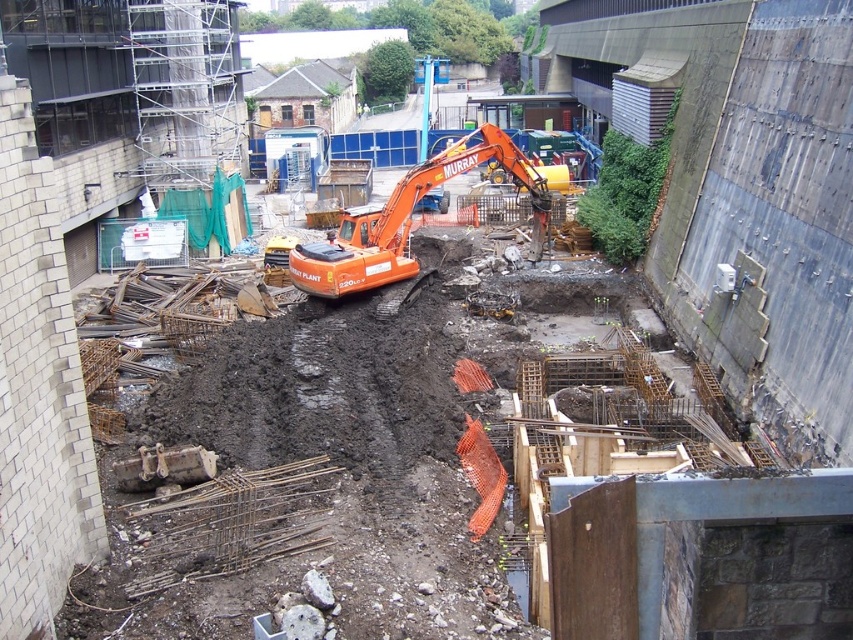
Question: Does orange rubber excavator at center appear on the right side of orange hard hat at center?

Choices:
 (A) yes
 (B) no

Answer: (A)

Question: Which of the following is the closest to the observer?

Choices:
 (A) coord(326,241)
 (B) coord(408,227)

Answer: (B)

Question: Can you confirm if orange rubber excavator at center is smaller than orange hard hat at center?

Choices:
 (A) yes
 (B) no

Answer: (B)

Question: Which object appears farthest from the camera in this image?

Choices:
 (A) orange hard hat at center
 (B) orange rubber excavator at center

Answer: (A)

Question: Does orange rubber excavator at center have a smaller size compared to orange hard hat at center?

Choices:
 (A) yes
 (B) no

Answer: (B)

Question: Which of the following is the farthest from the observer?

Choices:
 (A) (341, 246)
 (B) (399, 230)

Answer: (B)